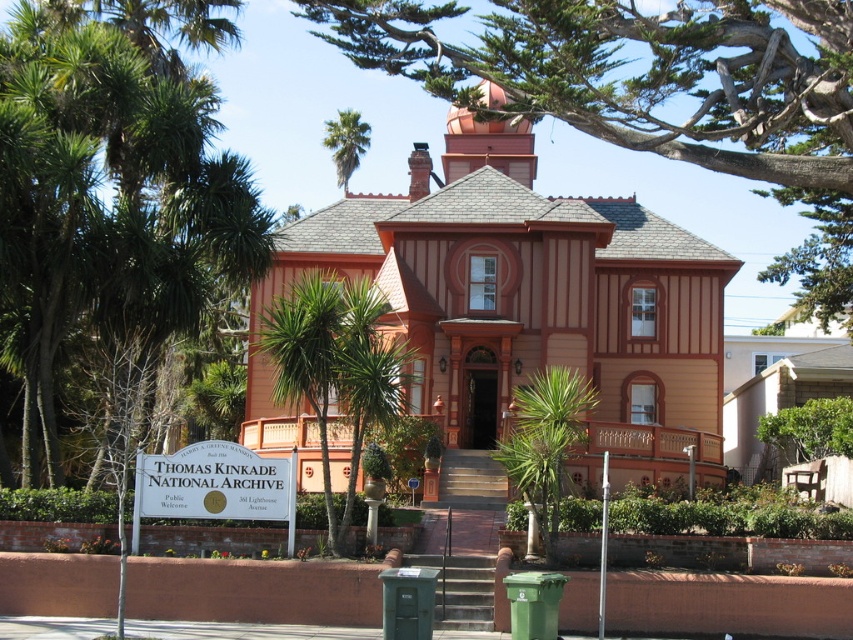
Question: Estimate the real-world distances between objects in this image. Which object is farther from the green leafy tree at upper center?

Choices:
 (A) green leafy palm tree at upper center
 (B) green leafy palm tree at left

Answer: (A)

Question: Which object is closer to the camera taking this photo?

Choices:
 (A) green leafy palm tree at upper center
 (B) green leafy palm tree at left
 (C) green leafy tree at upper center

Answer: (B)

Question: Among these objects, which one is farthest from the camera?

Choices:
 (A) green leafy palm tree at left
 (B) green leafy palm tree at upper center
 (C) green leafy tree at upper center

Answer: (B)

Question: Does green leafy palm tree at left come behind green leafy palm tree at upper center?

Choices:
 (A) no
 (B) yes

Answer: (A)

Question: Does green leafy palm tree at left have a lesser width compared to green leafy tree at upper center?

Choices:
 (A) yes
 (B) no

Answer: (A)

Question: Can you confirm if green leafy palm tree at left is positioned to the right of green leafy tree at upper center?

Choices:
 (A) no
 (B) yes

Answer: (A)